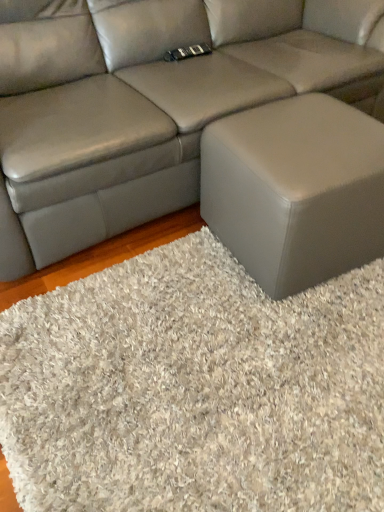
Find the location of a particular element. The image size is (384, 512). vacant area that lies in front of matte gray ottoman at lower right is located at coordinates (286, 346).